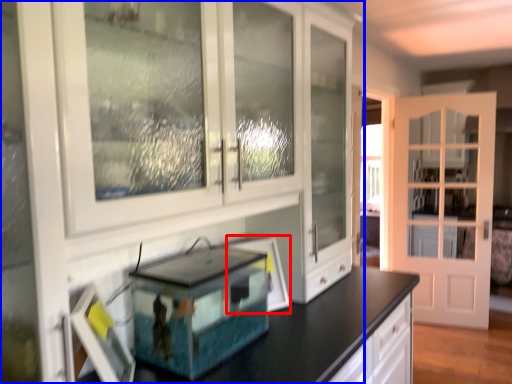
Question: Which of the following is the farthest to the observer, picture frame (highlighted by a red box) or cabinetry (highlighted by a blue box)?

Choices:
 (A) picture frame
 (B) cabinetry

Answer: (A)